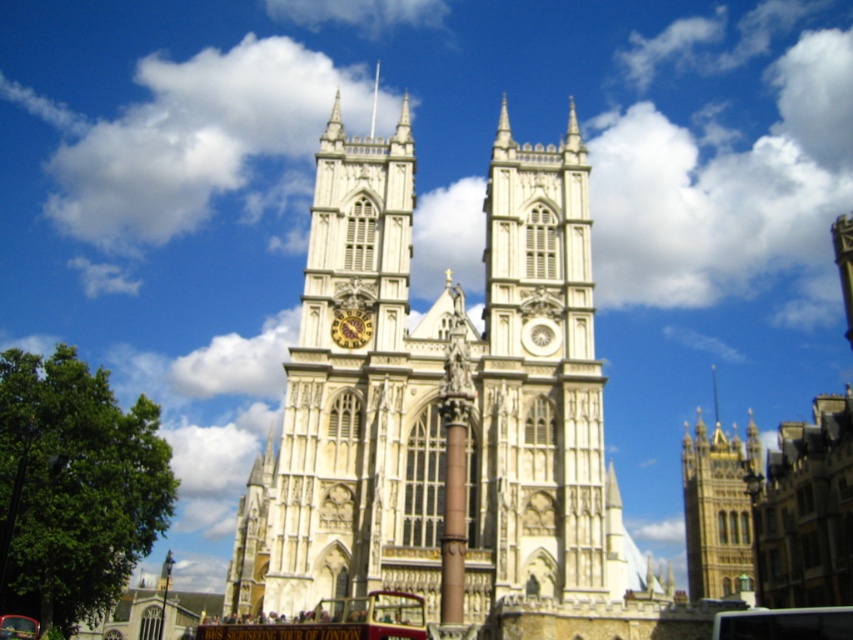
You are an architect visiting Westminster Abbey and want to measure the distance between the white stone clock tower at center and the gold textured clock at center. According to the description, how far apart are they?

The white stone clock tower at center and gold textured clock at center are 37.00 feet apart.

You are standing in front of Westminster Abbey and notice the white stone church at center and the gold textured clock at center. Which object is positioned to the left of the other?

The gold textured clock at center is to the left of the white stone church at center.